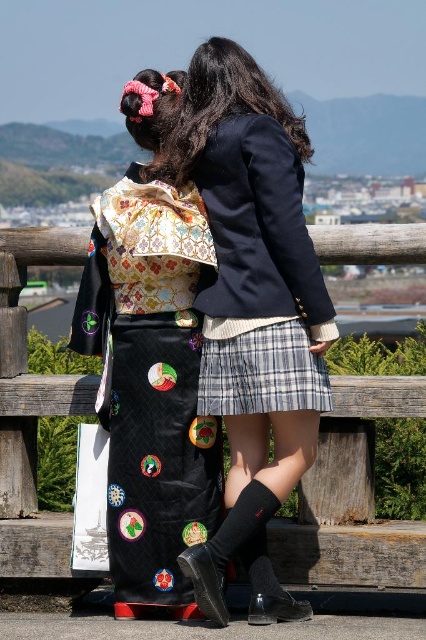
Is point (175, 556) positioned in front of point (296, 369)?

No, (175, 556) is further to viewer.

Is black quilted kimono at center bigger than plaid fabric skirt at center?

Indeed, black quilted kimono at center has a larger size compared to plaid fabric skirt at center.

The image size is (426, 640). What are the coordinates of `black quilted kimono at center` in the screenshot? It's located at (150, 360).

Where is `black quilted kimono at center`? The height and width of the screenshot is (640, 426). black quilted kimono at center is located at coordinates (150, 360).

Between black quilted kimono at center and black leather boot at lower center, which one is positioned lower?

Positioned lower is black leather boot at lower center.

The width and height of the screenshot is (426, 640). Describe the element at coordinates (150, 360) in the screenshot. I see `black quilted kimono at center` at that location.

Is point (178, 433) positioned after point (199, 545)?

Yes, point (178, 433) is farther from viewer.

Find the location of a particular element. black quilted kimono at center is located at coordinates (150, 360).

Between point (213, 196) and point (144, 97), which one is positioned in front?

Point (144, 97)

Which is below, matte black blazer at center or black quilted kimono at center?

black quilted kimono at center

This screenshot has width=426, height=640. Identify the location of matte black blazer at center. (255, 300).